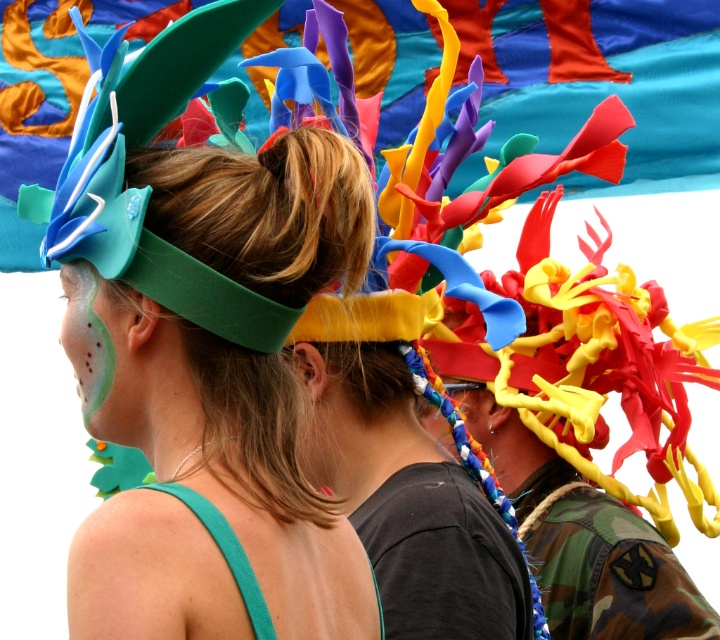
Question: Can you confirm if matte green headband at center is positioned below green matte face paint at center?

Choices:
 (A) no
 (B) yes

Answer: (B)

Question: Which point is closer to the camera?

Choices:
 (A) green matte face paint at center
 (B) brown hair at center

Answer: (B)

Question: Is matte green headband at center wider than green matte face paint at center?

Choices:
 (A) yes
 (B) no

Answer: (A)

Question: Based on their relative distances, which object is farther from the green matte face paint at center?

Choices:
 (A) matte green headband at center
 (B) brown hair at center

Answer: (A)

Question: Which is farther from the matte green headband at center?

Choices:
 (A) brown hair at center
 (B) green matte face paint at center

Answer: (B)

Question: Does brown hair at center lie behind green matte face paint at center?

Choices:
 (A) yes
 (B) no

Answer: (B)